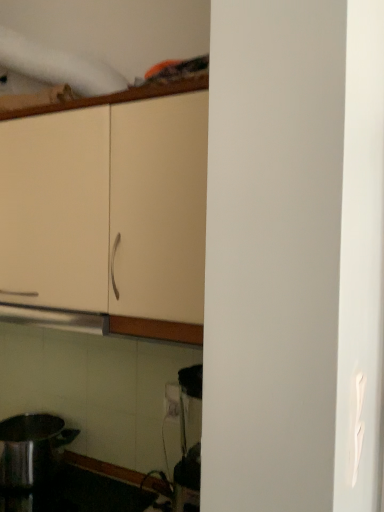
Find the location of a particular element. shiny metallic pot at lower left is located at coordinates (31, 449).

In order to face shiny metallic pot at lower left, should I rotate leftwards or rightwards?

Turn left by 20.207 degrees to look at shiny metallic pot at lower left.

What do you see at coordinates (31, 449) in the screenshot? I see `shiny metallic pot at lower left` at bounding box center [31, 449].

Measure the distance between point (160, 243) and camera.

Point (160, 243) is 36.97 inches from camera.

This screenshot has width=384, height=512. I want to click on matte cream cabinet at upper left, so coord(108,215).

Describe the element at coordinates (108, 215) in the screenshot. I see `matte cream cabinet at upper left` at that location.

The image size is (384, 512). Identify the location of shiny metallic pot at lower left. (31, 449).

Visually, is shiny metallic pot at lower left positioned to the left or to the right of matte cream cabinet at upper left?

shiny metallic pot at lower left is positioned on matte cream cabinet at upper left's left side.

Which object is further away from the camera taking this photo, shiny metallic pot at lower left or matte cream cabinet at upper left?

shiny metallic pot at lower left is further away from the camera.

Does point (6, 465) appear closer or farther from the camera than point (37, 116)?

Point (6, 465).

From the image's perspective, is shiny metallic pot at lower left above or below matte cream cabinet at upper left?

From the image's perspective, shiny metallic pot at lower left appears below matte cream cabinet at upper left.

From a real-world perspective, which is physically above, shiny metallic pot at lower left or matte cream cabinet at upper left?

matte cream cabinet at upper left, from a real-world perspective.

Does shiny metallic pot at lower left have a lesser width compared to matte cream cabinet at upper left?

Yes.

Considering the relative sizes of shiny metallic pot at lower left and matte cream cabinet at upper left in the image provided, is shiny metallic pot at lower left shorter than matte cream cabinet at upper left?

Correct, shiny metallic pot at lower left is not as tall as matte cream cabinet at upper left.

Who is bigger, shiny metallic pot at lower left or matte cream cabinet at upper left?

Bigger between the two is matte cream cabinet at upper left.

Is shiny metallic pot at lower left completely or partially outside of matte cream cabinet at upper left?

shiny metallic pot at lower left is positioned outside matte cream cabinet at upper left.

Is shiny metallic pot at lower left far away from matte cream cabinet at upper left?

shiny metallic pot at lower left is actually quite close to matte cream cabinet at upper left.

Is shiny metallic pot at lower left oriented away from matte cream cabinet at upper left?

No, shiny metallic pot at lower left is not facing the opposite direction of matte cream cabinet at upper left.

How many degrees apart are the facing directions of shiny metallic pot at lower left and matte cream cabinet at upper left?

The angle between the facing direction of shiny metallic pot at lower left and the facing direction of matte cream cabinet at upper left is 0.142 degrees.

Where is `cabinetry lying on the right of shiny metallic pot at lower left`? Image resolution: width=384 pixels, height=512 pixels. cabinetry lying on the right of shiny metallic pot at lower left is located at coordinates (108, 215).

Which object is positioned more to the left, matte cream cabinet at upper left or shiny metallic pot at lower left?

Positioned to the left is shiny metallic pot at lower left.

Considering their positions, is matte cream cabinet at upper left located in front of or behind shiny metallic pot at lower left?

In the image, matte cream cabinet at upper left appears in front of shiny metallic pot at lower left.

Does point (101, 209) come behind point (52, 425)?

No, (101, 209) is closer to viewer.

From the image's perspective, which is above, matte cream cabinet at upper left or shiny metallic pot at lower left?

matte cream cabinet at upper left, from the image's perspective.

From a real-world perspective, is matte cream cabinet at upper left under shiny metallic pot at lower left?

No, from a real-world perspective, matte cream cabinet at upper left is not beneath shiny metallic pot at lower left.

Considering the sizes of objects matte cream cabinet at upper left and shiny metallic pot at lower left in the image provided, who is thinner, matte cream cabinet at upper left or shiny metallic pot at lower left?

shiny metallic pot at lower left is thinner.

Is matte cream cabinet at upper left taller or shorter than shiny metallic pot at lower left?

Clearly, matte cream cabinet at upper left is taller compared to shiny metallic pot at lower left.

Can you confirm if matte cream cabinet at upper left is smaller than shiny metallic pot at lower left?

No.

From the picture: Choose the correct answer: Is matte cream cabinet at upper left inside shiny metallic pot at lower left or outside it?

matte cream cabinet at upper left exists outside the volume of shiny metallic pot at lower left.

Is matte cream cabinet at upper left far away from shiny metallic pot at lower left?

Actually, matte cream cabinet at upper left and shiny metallic pot at lower left are a little close together.

Is matte cream cabinet at upper left oriented towards shiny metallic pot at lower left?

No, matte cream cabinet at upper left is not turned towards shiny metallic pot at lower left.

What's the angular difference between matte cream cabinet at upper left and shiny metallic pot at lower left's facing directions?

There is a 0.142-degree angle between the facing directions of matte cream cabinet at upper left and shiny metallic pot at lower left.

The height and width of the screenshot is (512, 384). Identify the location of kitchen appliance located behind the matte cream cabinet at upper left. (31, 449).

I want to click on kitchen appliance behind the matte cream cabinet at upper left, so click(31, 449).

Find the location of `cabinetry above the shiny metallic pot at lower left (from the image's perspective)`. cabinetry above the shiny metallic pot at lower left (from the image's perspective) is located at coordinates (108, 215).